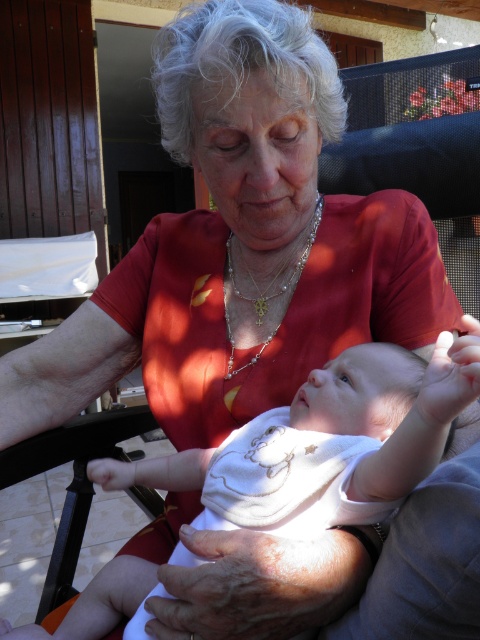
Who is more forward, (173, 472) or (272, 280)?

Point (173, 472) is in front.

Which of these two, white soft fabric baby at center or pearl/pearly necklace at center, stands shorter?

Standing shorter between the two is pearl/pearly necklace at center.

Does point (93, 480) come behind point (291, 273)?

No.

Identify the location of white soft fabric baby at center. (391, 408).